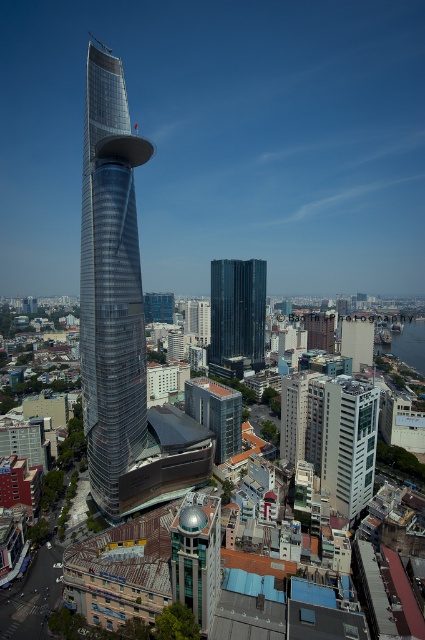
Is the position of shiny glass tower at center more distant than that of white glass building at center?

That is False.

Which is more to the right, shiny glass tower at center or white glass building at center?

white glass building at center

In the scene shown: Who is more forward, (127, 364) or (354, 426)?

Point (354, 426) is more forward.

The height and width of the screenshot is (640, 425). What are the coordinates of `shiny glass tower at center` in the screenshot? It's located at (110, 284).

Which is more to the right, white glass building at center or black glass tower at center?

From the viewer's perspective, white glass building at center appears more on the right side.

Who is more forward, (323, 452) or (220, 330)?

Point (323, 452) is more forward.

The height and width of the screenshot is (640, 425). What are the coordinates of `white glass building at center` in the screenshot? It's located at (342, 440).

Find the location of a particular element. shiny glass tower at center is located at coordinates (110, 284).

In the scene shown: Is shiny glass tower at center smaller than black glass tower at center?

No.

Is point (122, 320) positioned before point (243, 285)?

Yes, it is.

I want to click on shiny glass tower at center, so click(x=110, y=284).